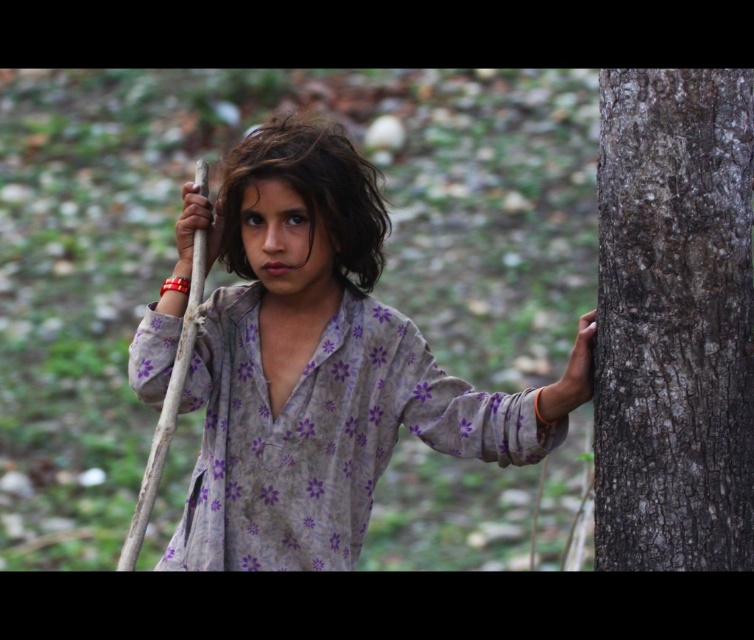
Does floral-patterned cloth at center have a lesser height compared to smooth gray bark at right?

No.

Is point (375, 260) behind point (608, 461)?

Yes, point (375, 260) is behind point (608, 461).

This screenshot has height=640, width=754. Describe the element at coordinates (311, 364) in the screenshot. I see `floral-patterned cloth at center` at that location.

Locate an element on the screen. floral-patterned cloth at center is located at coordinates pyautogui.click(x=311, y=364).